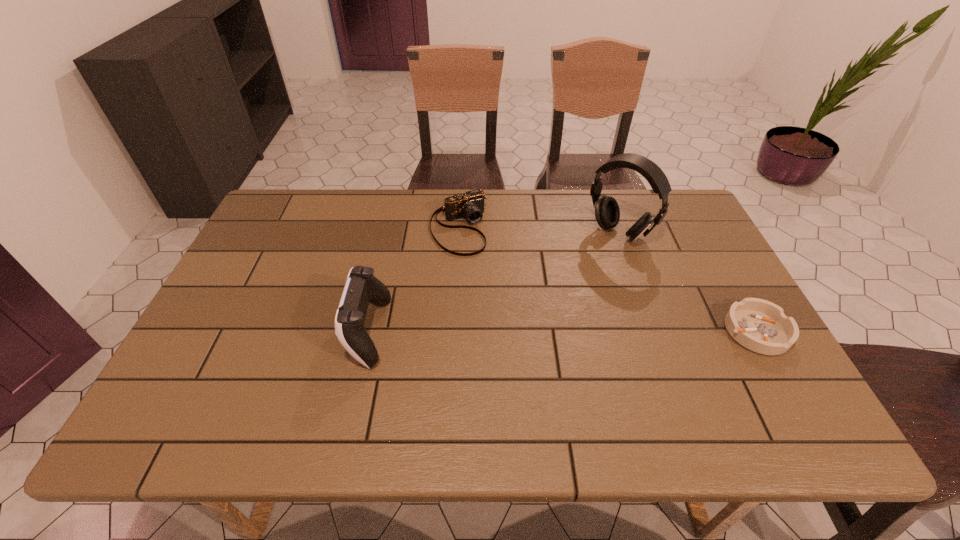
I want to click on free spot between the leftmost object and the earphone, so 493,282.

Find the location of `vacant area that lies between the leftmost object and the third object from right to left`. vacant area that lies between the leftmost object and the third object from right to left is located at coordinates (413, 280).

Find the location of a particular element. The height and width of the screenshot is (540, 960). free space that is in between the rightmost object and the earphone is located at coordinates (687, 282).

Locate an element on the screen. The width and height of the screenshot is (960, 540). vacant space that's between the control and the third tallest object is located at coordinates (413, 280).

Identify the location of vacant area that lies between the rightmost object and the tallest object. Image resolution: width=960 pixels, height=540 pixels. (687, 282).

At what (x,y) coordinates should I click in order to perform the action: click on vacant space that is in between the ashtray and the second object from right to left. Please return your answer as a coordinate pair (x, y). The height and width of the screenshot is (540, 960). Looking at the image, I should click on (687, 282).

Where is `object that ranks as the second closest to the leftmost object`? Image resolution: width=960 pixels, height=540 pixels. object that ranks as the second closest to the leftmost object is located at coordinates (607, 213).

Select which object is the second closest to the earphone. Please provide its 2D coordinates. Your answer should be formatted as a tuple, i.e. [(x, y)], where the tuple contains the x and y coordinates of a point satisfying the conditions above.

[(470, 205)]